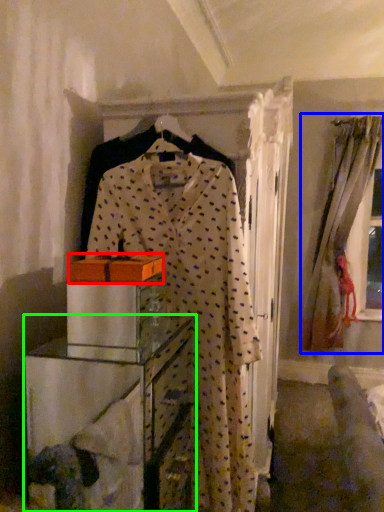
Question: Which object is positioned closest to cardboard box (highlighted by a red box)? Select from window (highlighted by a blue box) and furniture (highlighted by a green box).

Choices:
 (A) window
 (B) furniture

Answer: (B)